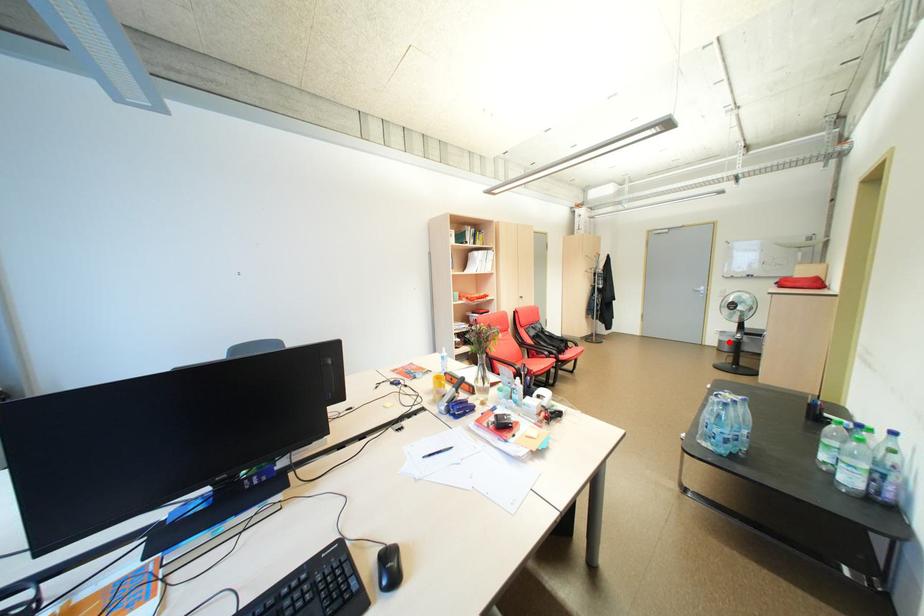
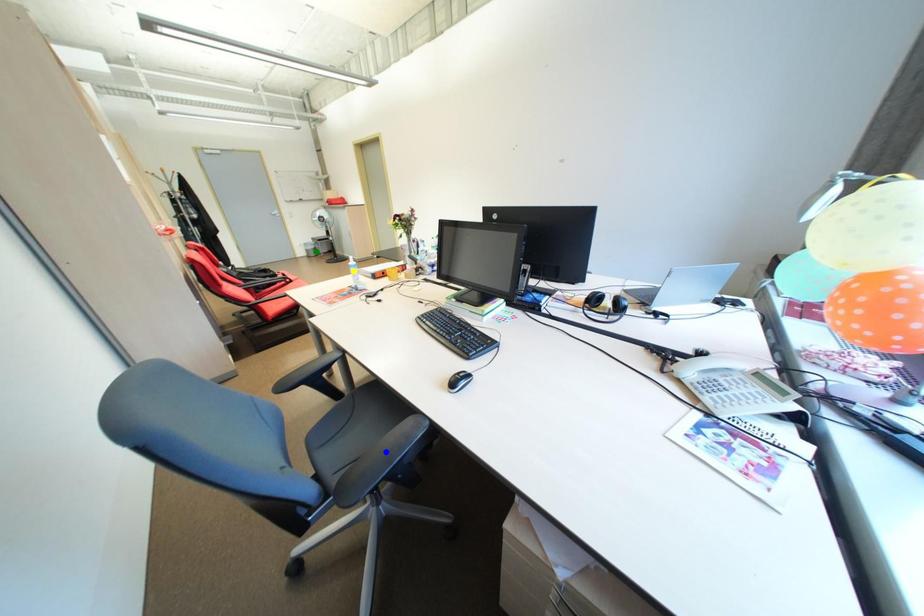
Question: I am providing you with two images of the same scene from different viewpoints. A red point is marked on the first image. You are given multiple points on the second image. Which point in image 2 is actually the same real-world point as the red point in image 1?

Choices:
 (A) green point
 (B) blue point
 (C) yellow point

Answer: (A)